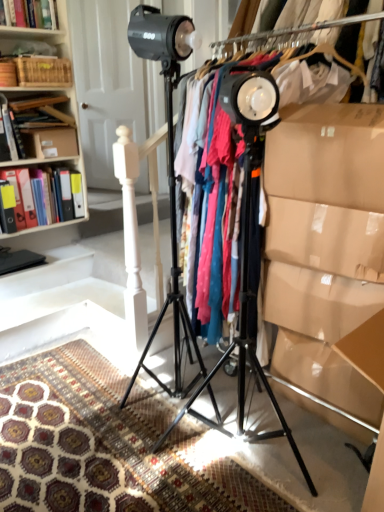
Question: From the image's perspective, is black matte tripod at center, which is the first tripod from left to right, under matte plastic folders at left, which is the 2th book from bottom to top?

Choices:
 (A) yes
 (B) no

Answer: (A)

Question: Is black matte tripod at center, which appears as the second tripod when viewed from the right, positioned behind matte plastic folders at left, which is the 2th book from bottom to top?

Choices:
 (A) no
 (B) yes

Answer: (A)

Question: Is black matte tripod at center, which is the first tripod from left to right, facing towards matte plastic folders at left, which is the 2th book from bottom to top?

Choices:
 (A) yes
 (B) no

Answer: (B)

Question: Considering the relative sizes of black matte tripod at center, which appears as the second tripod when viewed from the right, and matte plastic folders at left, positioned as the second book in top-to-bottom order, in the image provided, is black matte tripod at center, which appears as the second tripod when viewed from the right, bigger than matte plastic folders at left, positioned as the second book in top-to-bottom order,?

Choices:
 (A) yes
 (B) no

Answer: (A)

Question: From the image's perspective, is black matte tripod at center, which is the first tripod from left to right, above matte plastic folders at left, which is the 2th book from bottom to top?

Choices:
 (A) no
 (B) yes

Answer: (A)

Question: Considering their positions, is brown cardboard box at upper left located in front of or behind hardcover book at upper left, positioned as the 3th book in bottom-to-top order?

Choices:
 (A) front
 (B) behind

Answer: (B)

Question: Based on their sizes in the image, would you say brown cardboard box at upper left is bigger or smaller than hardcover book at upper left, positioned as the 3th book in bottom-to-top order?

Choices:
 (A) big
 (B) small

Answer: (B)

Question: Is brown cardboard box at upper left to the left or to the right of hardcover book at upper left, positioned as the 3th book in bottom-to-top order, in the image?

Choices:
 (A) right
 (B) left

Answer: (A)

Question: From a real-world perspective, is brown cardboard box at upper left physically located above or below hardcover book at upper left, the 1th book when ordered from top to bottom?

Choices:
 (A) below
 (B) above

Answer: (A)

Question: Would you say matte plastic folders at left, which is the 2th book from bottom to top, is to the left or to the right of wooden crate at upper left in the picture?

Choices:
 (A) right
 (B) left

Answer: (B)

Question: Is matte plastic folders at left, positioned as the second book in top-to-bottom order, wider or thinner than wooden crate at upper left?

Choices:
 (A) thin
 (B) wide

Answer: (B)

Question: In terms of size, does matte plastic folders at left, positioned as the second book in top-to-bottom order, appear bigger or smaller than wooden crate at upper left?

Choices:
 (A) small
 (B) big

Answer: (B)

Question: Considering the positions of point (3, 166) and point (51, 58), is point (3, 166) closer or farther from the camera than point (51, 58)?

Choices:
 (A) closer
 (B) farther

Answer: (A)

Question: Looking at the image, does black matte tripod at center, which is the first tripod from left to right, seem bigger or smaller compared to black matte tripod at center, placed as the first tripod when sorted from right to left?

Choices:
 (A) small
 (B) big

Answer: (A)

Question: Is black matte tripod at center, which is the first tripod from left to right, to the left or to the right of black matte tripod at center, the 2th tripod when ordered from left to right, in the image?

Choices:
 (A) left
 (B) right

Answer: (A)